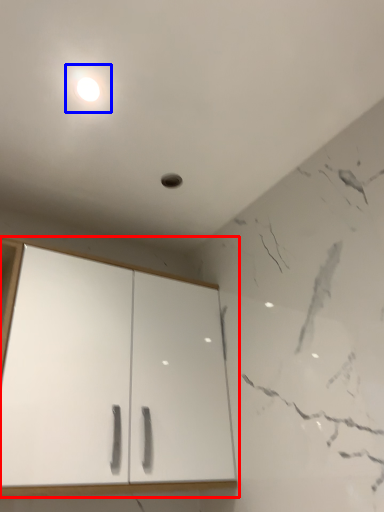
Question: Which point is closer to the camera, cupboard (highlighted by a red box) or light (highlighted by a blue box)?

Choices:
 (A) cupboard
 (B) light

Answer: (A)